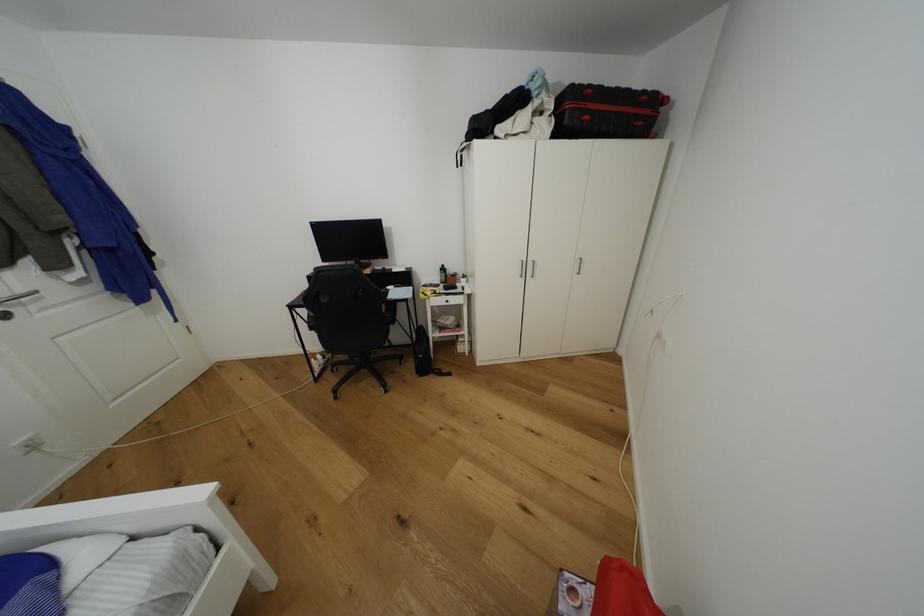
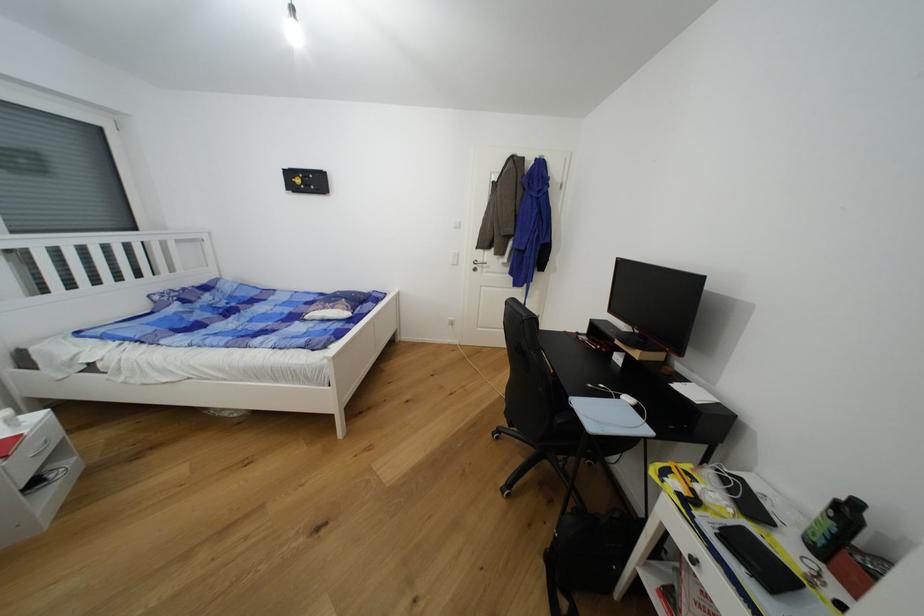
The point at (447, 267) is marked in the first image. Where is the corresponding point in the second image?

(862, 506)